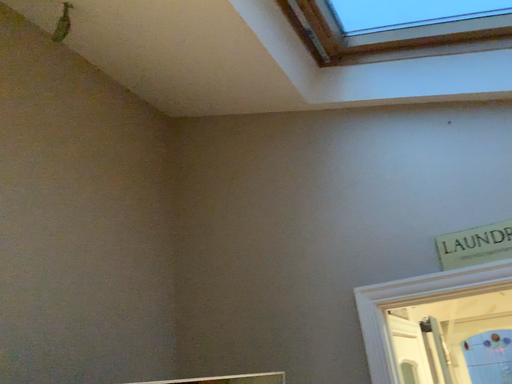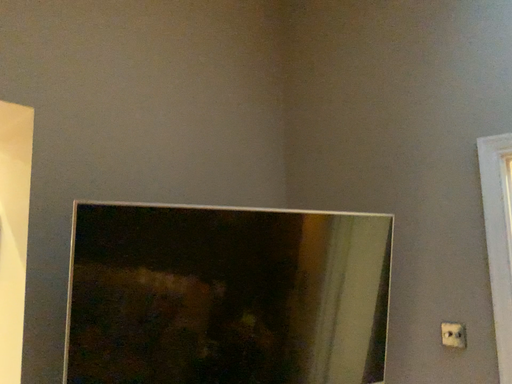
Question: Which way did the camera rotate in the video?

Choices:
 (A) rotated right
 (B) rotated left

Answer: (B)